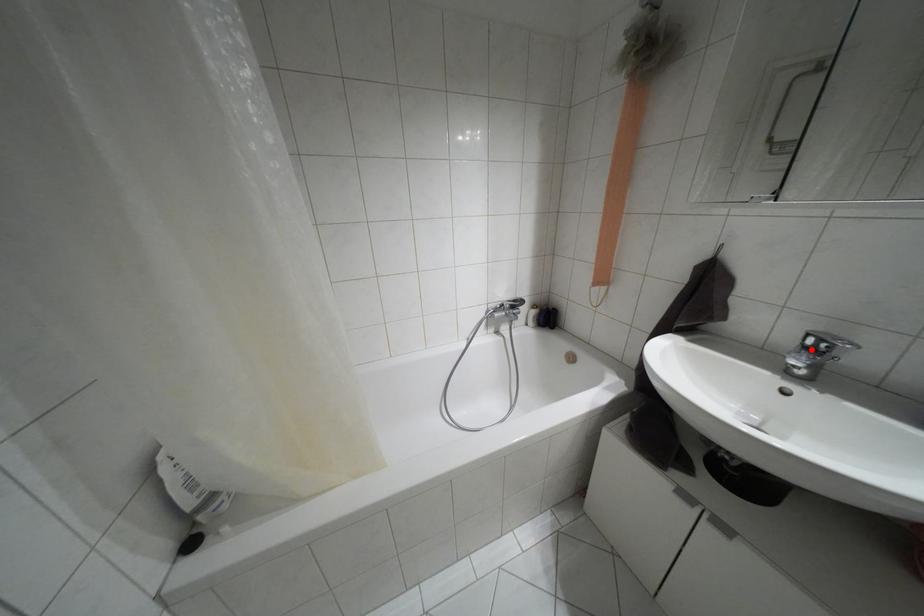
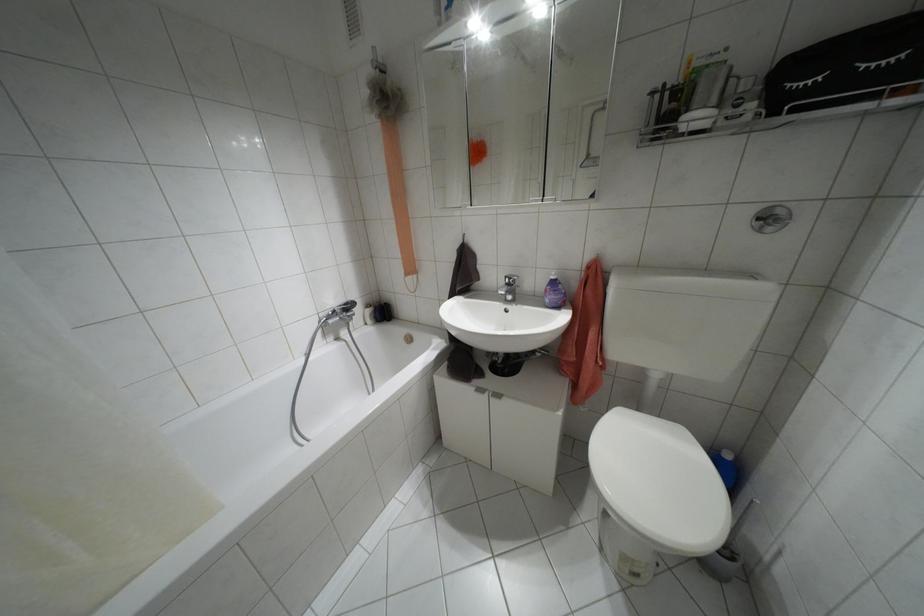
In the second image, find the point that corresponds to the highlighted location in the first image.

(507, 284)